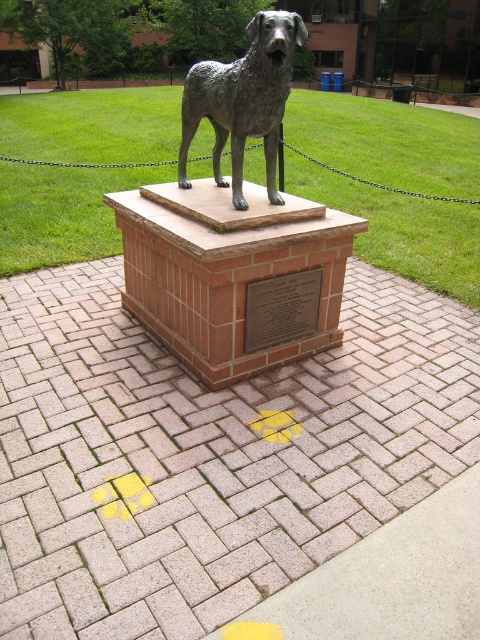
Question: Does bronze statue of a dog at center appear over bronze plaque at center?

Choices:
 (A) yes
 (B) no

Answer: (A)

Question: Does bronze statue of a dog at center lie behind bronze plaque at center?

Choices:
 (A) no
 (B) yes

Answer: (A)

Question: Which of the following is the farthest from the observer?

Choices:
 (A) (292, 292)
 (B) (266, 116)

Answer: (A)

Question: Can you confirm if bronze statue of a dog at center is smaller than bronze plaque at center?

Choices:
 (A) no
 (B) yes

Answer: (A)

Question: Which point is farther to the camera?

Choices:
 (A) bronze statue of a dog at center
 (B) bronze plaque at center

Answer: (B)